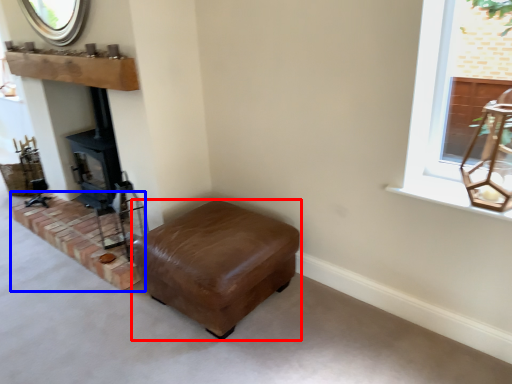
Question: Which object appears closest to the camera in this image, furniture (highlighted by a red box) or brickwork (highlighted by a blue box)?

Choices:
 (A) furniture
 (B) brickwork

Answer: (A)